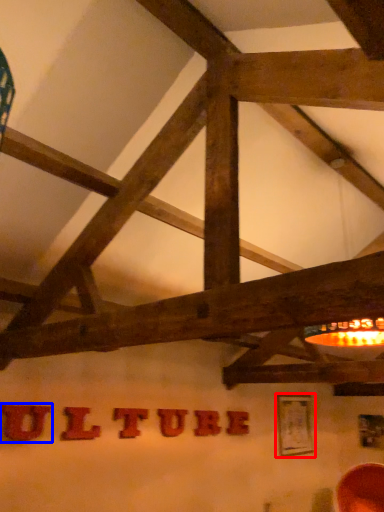
Question: Which point is further to the camera, picture frame (highlighted by a red box) or letter (highlighted by a blue box)?

Choices:
 (A) picture frame
 (B) letter

Answer: (A)